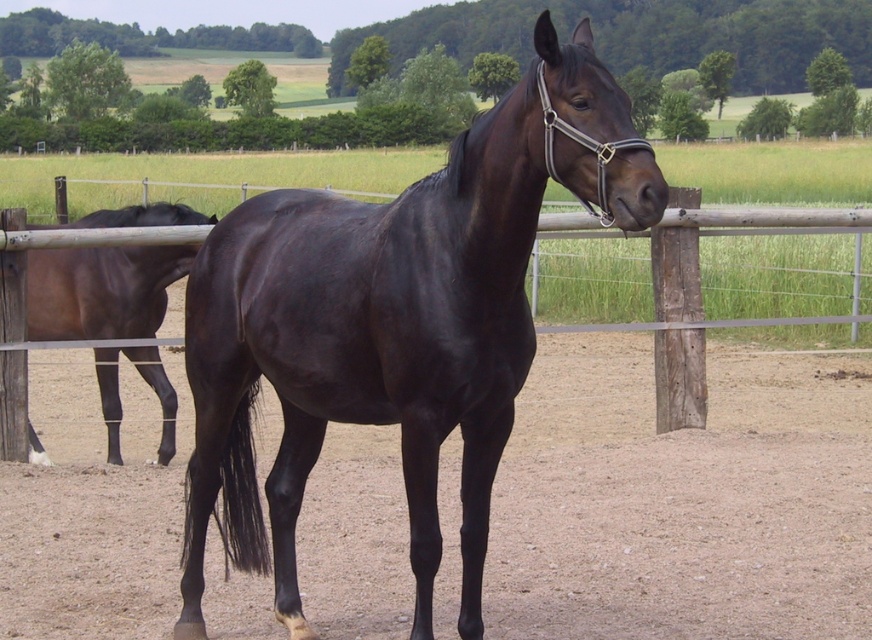
You are standing in the fenced enclosure looking at the scene. There is dirt at center and a shiny black horse at center. Which object is located to the left of the other?

The dirt at center is to the left of the shiny black horse at center.

You are a farmer checking the horses in the enclosure. You notice the shiny black horse at center and the brown glossy horse at left. Which horse would appear bigger to you from your current viewpoint?

The shiny black horse at center appears bigger because it is larger in size than the brown glossy horse at left according to the description.

You are standing in the fenced enclosure looking at the two horses. There are two points marked in the image. Which point, point (307, 200) or point (118, 225), is closer to you?

Point (307, 200) is closer to the viewer than point (118, 225).